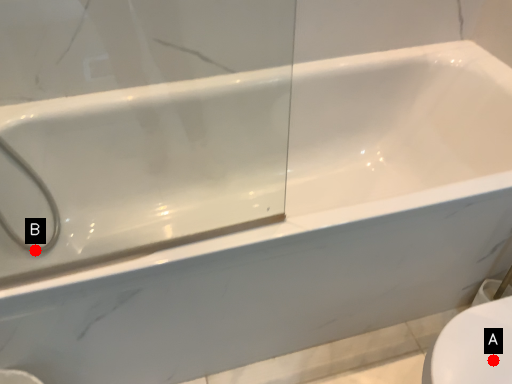
Question: Two points are circled on the image, labeled by A and B beside each circle. Which point is closer to the camera?

Choices:
 (A) A is closer
 (B) B is closer

Answer: (A)